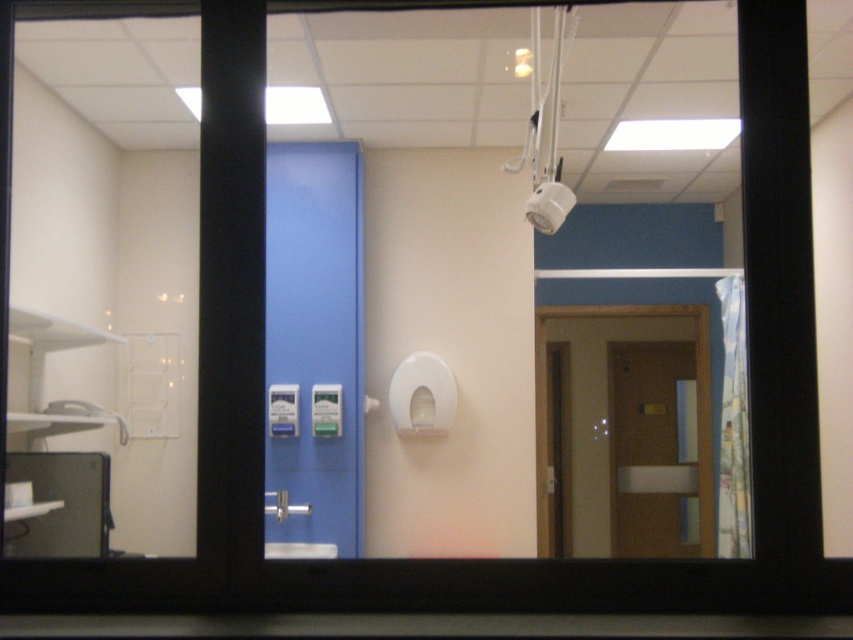
You are a patient in a healthcare facility and need to exit the room. The blue glossy cabinet at center and the matte brown door at right are in your line of sight. Which object should you approach first to exit?

You should approach the matte brown door at right first because the blue glossy cabinet at center is closer to you, so the door is further away and not the nearest exit point.

In the scene shown: You are standing outside the room and looking through the window. The blue glossy cabinet at center is located at point 0.542, 0.369 on the window frame. If you want to reach it, which direction should you move relative to the window?

Since the blue glossy cabinet at center is located at point [314,346] on the window frame, you should move towards the center of the window to reach it.